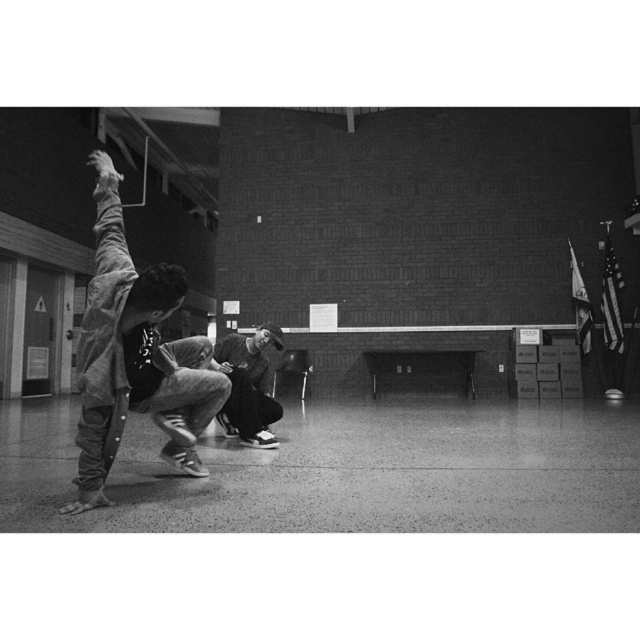
Does matte black skateboard at left appear under dark gray hoodie at center?

Actually, matte black skateboard at left is above dark gray hoodie at center.

Is matte black skateboard at left closer to the viewer compared to dark gray hoodie at center?

Yes, it is in front of dark gray hoodie at center.

Who is more forward, (84, 396) or (253, 394)?

Point (84, 396)

This screenshot has height=640, width=640. I want to click on matte black skateboard at left, so click(132, 355).